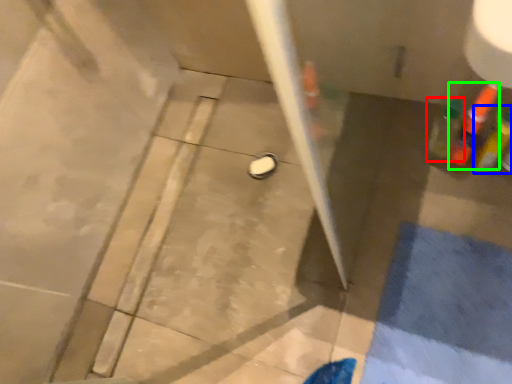
Question: Which is farther away from bottle (highlighted by a red box)? bottle (highlighted by a blue box) or bottle (highlighted by a green box)?

Choices:
 (A) bottle
 (B) bottle

Answer: (A)